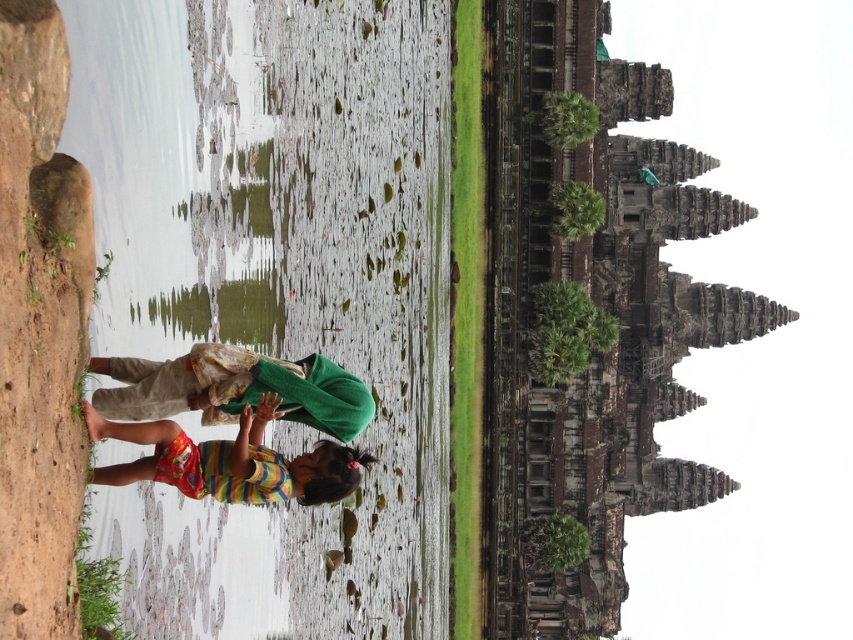
Question: Which point is farther to the camera?

Choices:
 (A) (234, 349)
 (B) (36, 561)
 (C) (613, 113)
 (D) (285, 472)

Answer: (C)

Question: Is brown rough rock at left closer to camera compared to multicolored striped shirt at center?

Choices:
 (A) yes
 (B) no

Answer: (A)

Question: Does brown rough rock at left appear on the right side of multicolored striped shirt at center?

Choices:
 (A) no
 (B) yes

Answer: (A)

Question: Which of these objects is positioned farthest from the green fabric at center?

Choices:
 (A) brown rough rock at left
 (B) rusty stone temple at upper right
 (C) multicolored striped shirt at center

Answer: (B)

Question: Estimate the real-world distances between objects in this image. Which object is farther from the green fabric at center?

Choices:
 (A) rusty stone temple at upper right
 (B) brown rough rock at left
 (C) multicolored striped shirt at center

Answer: (A)

Question: Can you confirm if brown rough rock at left is thinner than green fabric at center?

Choices:
 (A) no
 (B) yes

Answer: (B)